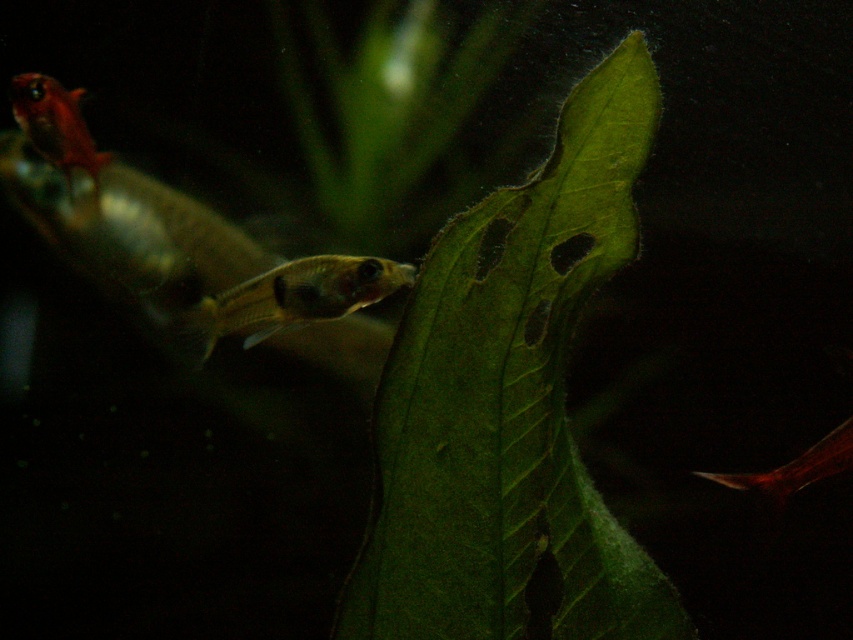
Is translucent yellowish-green fish at center positioned in front of translucent red fish at lower right?

No, translucent yellowish-green fish at center is behind translucent red fish at lower right.

You are a GUI agent. You are given a task and a screenshot of the screen. Output one action in this format:
    pyautogui.click(x=<x>, y=<y>)
    Task: Click on the translucent yellowish-green fish at center
    
    Given the screenshot: What is the action you would take?
    pyautogui.click(x=183, y=253)

Is translucent yellow fish at center wider than translucent red fish at lower right?

Correct, the width of translucent yellow fish at center exceeds that of translucent red fish at lower right.

Is point (346, 305) positioned after point (816, 477)?

Yes, point (346, 305) is behind point (816, 477).

Which is in front, point (224, 332) or point (811, 448)?

Point (811, 448) is in front.

You are a GUI agent. You are given a task and a screenshot of the screen. Output one action in this format:
    pyautogui.click(x=<x>, y=<y>)
    Task: Click on the translucent yellow fish at center
    
    Given the screenshot: What is the action you would take?
    pyautogui.click(x=289, y=300)

Which is behind, point (236, 330) or point (62, 88)?

The point (62, 88) is more distant.

Describe the element at coordinates (289, 300) in the screenshot. This screenshot has width=853, height=640. I see `translucent yellow fish at center` at that location.

The image size is (853, 640). I want to click on translucent yellow fish at center, so click(x=289, y=300).